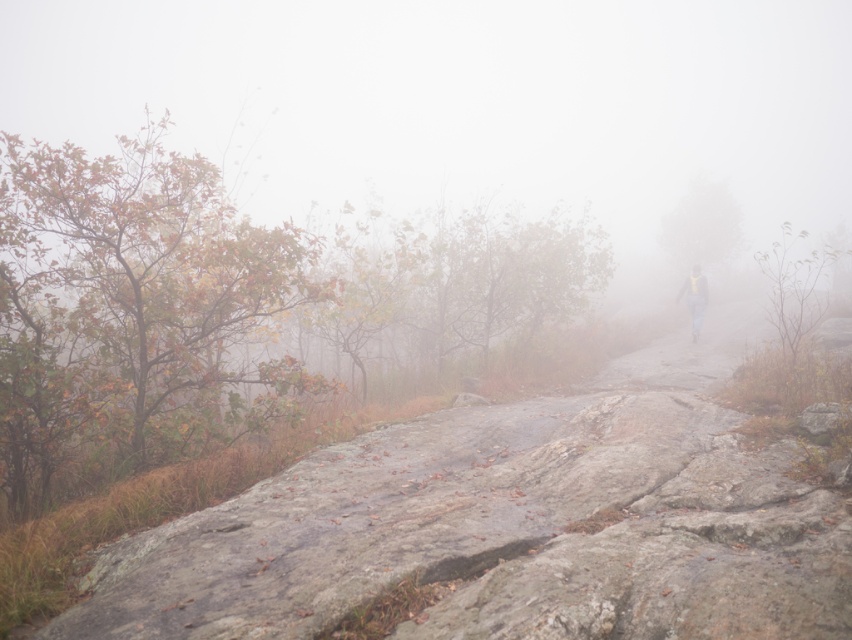
Question: Is gray rough rock at center positioned before yellow reflective vest at center?

Choices:
 (A) no
 (B) yes

Answer: (B)

Question: Which of the following is the closest to the observer?

Choices:
 (A) (698, 298)
 (B) (628, 628)

Answer: (B)

Question: Can you confirm if gray rough rock at center is positioned below yellow reflective vest at center?

Choices:
 (A) no
 (B) yes

Answer: (B)

Question: Which point is closer to the camera?

Choices:
 (A) yellow reflective vest at center
 (B) gray rough rock at center

Answer: (B)

Question: Is the position of gray rough rock at center less distant than that of yellow reflective vest at center?

Choices:
 (A) yes
 (B) no

Answer: (A)